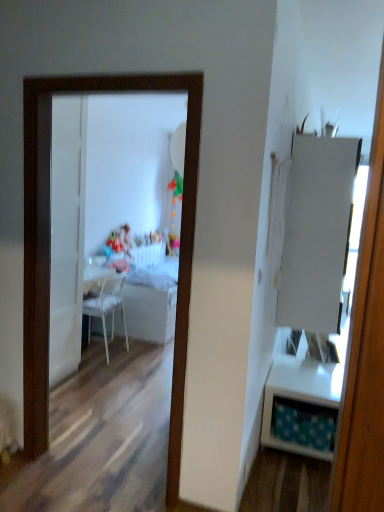
Question: Can you confirm if white plastic chair at center is smaller than white glossy mirror at center?

Choices:
 (A) no
 (B) yes

Answer: (B)

Question: Are white plastic chair at center and white glossy mirror at center far apart?

Choices:
 (A) yes
 (B) no

Answer: (A)

Question: Is white plastic chair at center to the left of white glossy mirror at center from the viewer's perspective?

Choices:
 (A) no
 (B) yes

Answer: (B)

Question: From the image's perspective, would you say white plastic chair at center is positioned over white glossy mirror at center?

Choices:
 (A) yes
 (B) no

Answer: (B)

Question: From a real-world perspective, is white plastic chair at center on top of white glossy mirror at center?

Choices:
 (A) no
 (B) yes

Answer: (A)

Question: Is white matte cabinet at right inside the boundaries of white glossy table at right, positioned as the 2th table in left-to-right order, or outside?

Choices:
 (A) outside
 (B) inside

Answer: (A)

Question: From the image's perspective, relative to white glossy table at right, positioned as the 2th table in left-to-right order, is white matte cabinet at right above or below?

Choices:
 (A) below
 (B) above

Answer: (B)

Question: Relative to white glossy table at right, marked as the second table in a back-to-front arrangement, is white matte cabinet at right in front or behind?

Choices:
 (A) front
 (B) behind

Answer: (B)

Question: Is point (327, 292) closer or farther from the camera than point (309, 398)?

Choices:
 (A) farther
 (B) closer

Answer: (A)

Question: Is white glossy table at right, positioned as the 2th table in left-to-right order, inside or outside of white glossy table at center, the second table from the front?

Choices:
 (A) inside
 (B) outside

Answer: (B)

Question: From a real-world perspective, is white glossy table at right, positioned as the 2th table in left-to-right order, positioned above or below white glossy table at center, the 1th table positioned from the back?

Choices:
 (A) above
 (B) below

Answer: (B)

Question: Is white glossy table at right, placed as the 1th table when sorted from front to back, bigger or smaller than white glossy table at center, the second table from the front?

Choices:
 (A) big
 (B) small

Answer: (B)

Question: Visually, is white glossy table at right, placed as the 1th table when sorted from front to back, positioned to the left or to the right of white glossy table at center, the first table viewed from the left?

Choices:
 (A) left
 (B) right

Answer: (B)

Question: From a real-world perspective, is white glossy table at center, the 2th table viewed from the right, above or below white glossy mirror at center?

Choices:
 (A) below
 (B) above

Answer: (A)

Question: In the image, is white glossy table at center, the 1th table positioned from the back, positioned in front of or behind white glossy mirror at center?

Choices:
 (A) front
 (B) behind

Answer: (B)